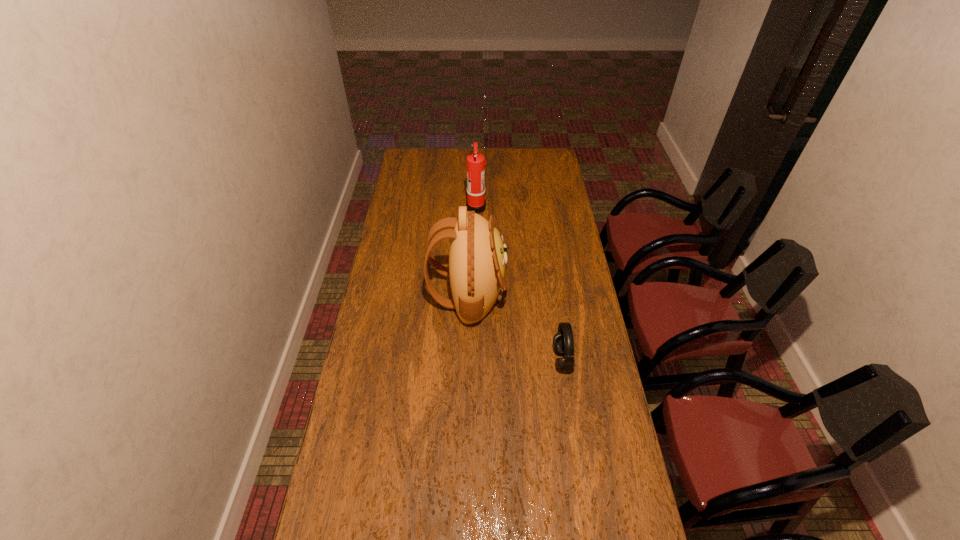
Locate an element on the screen. The height and width of the screenshot is (540, 960). free space at the far edge of the desktop is located at coordinates (437, 151).

This screenshot has width=960, height=540. What are the coordinates of `free location at the left edge of the desktop` in the screenshot? It's located at (400, 172).

Locate an element on the screen. vacant space at the right edge of the desktop is located at coordinates (564, 208).

In the image, there is a desktop. At what (x,y) coordinates should I click in order to perform the action: click on vacant region at the far right corner. Please return your answer as a coordinate pair (x, y). The image size is (960, 540). Looking at the image, I should click on (542, 161).

The height and width of the screenshot is (540, 960). Identify the location of free space between the headset and the third shortest object. (519, 283).

Identify the location of vacant space that is in between the farthest object and the third farthest object. This screenshot has width=960, height=540. (519, 283).

Locate which object is the third closest to the tiara. Please provide its 2D coordinates. Your answer should be formatted as a tuple, i.e. [(x, y)], where the tuple contains the x and y coordinates of a point satisfying the conditions above.

[(475, 161)]

Choose which object is the third nearest neighbor to the nearest object. Please provide its 2D coordinates. Your answer should be formatted as a tuple, i.e. [(x, y)], where the tuple contains the x and y coordinates of a point satisfying the conditions above.

[(475, 161)]